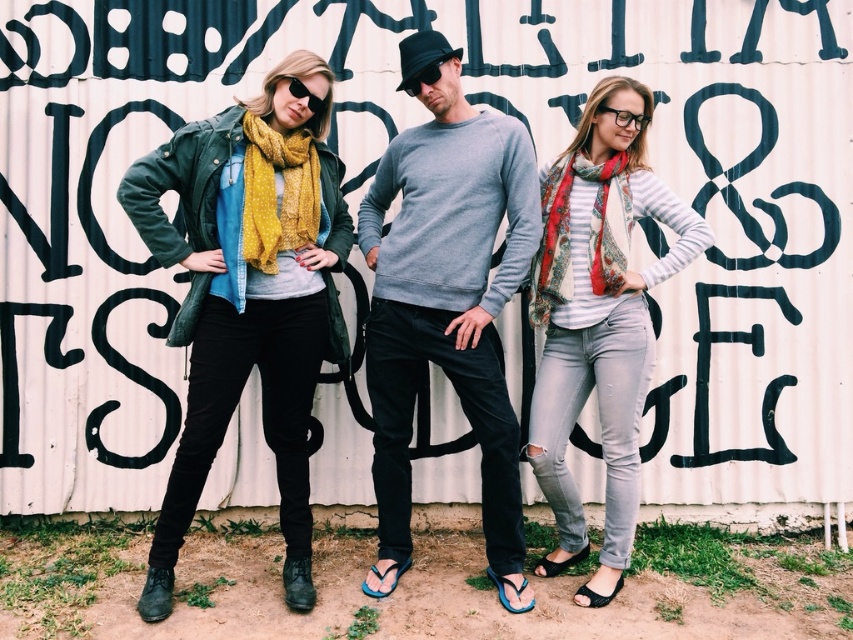
You are a photographer trying to capture the black matte sunglasses at center and the clear plastic glasses at center in the same frame. Which object appears closer to you in the photo?

The black matte sunglasses at center appears closer to you because it is positioned closer to the viewer than the clear plastic glasses at center.

You are a photographer setting up a tripod to capture the scene. The matte green jacket at left and the printed silk scarf at right are in your frame. Based on their positions, which object should you focus on first if you want to ensure both are in focus without adjusting the camera settings?

The matte green jacket at left is taller than the printed silk scarf at right, so focusing on the matte green jacket at left would ensure both are in focus since it is larger in the frame.

You are a photographer trying to capture a closeup shot of the matte green jacket at left and the printed silk scarf at right. Your camera has a maximum focus range of 1 meter. Can you photograph both items clearly without moving your camera position?

The matte green jacket at left is 1.24 meters away from the printed silk scarf at right. Since the distance between them exceeds the camera maximum focus range of 1 meter, you cannot photograph both items clearly without moving the camera position.